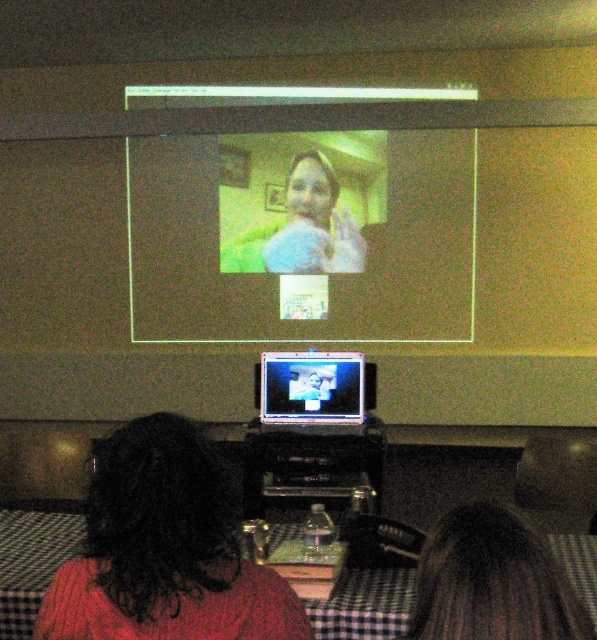
What is the position of the point at coordinates (303,236) in the image?

The point at coordinates (303,236) is located on the matte plastic screen at upper center.

You are standing behind the two people at the table and want to see both the matte plastic screen at upper center and the dark brown hair at lower right. Which object is closer to you?

The matte plastic screen at upper center is positioned over dark brown hair at lower right, so it is closer to you.